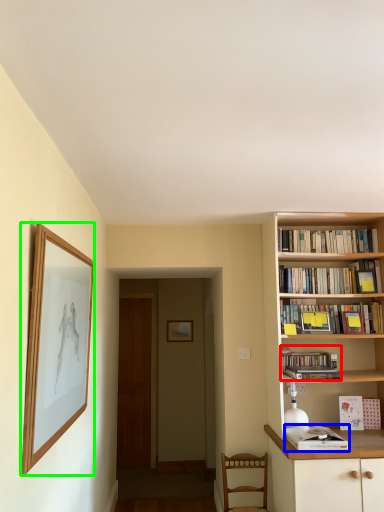
Question: Based on their relative distances, which object is farther from book (highlighted by a red box)? Choose from book (highlighted by a blue box) and picture frame (highlighted by a green box).

Choices:
 (A) book
 (B) picture frame

Answer: (B)